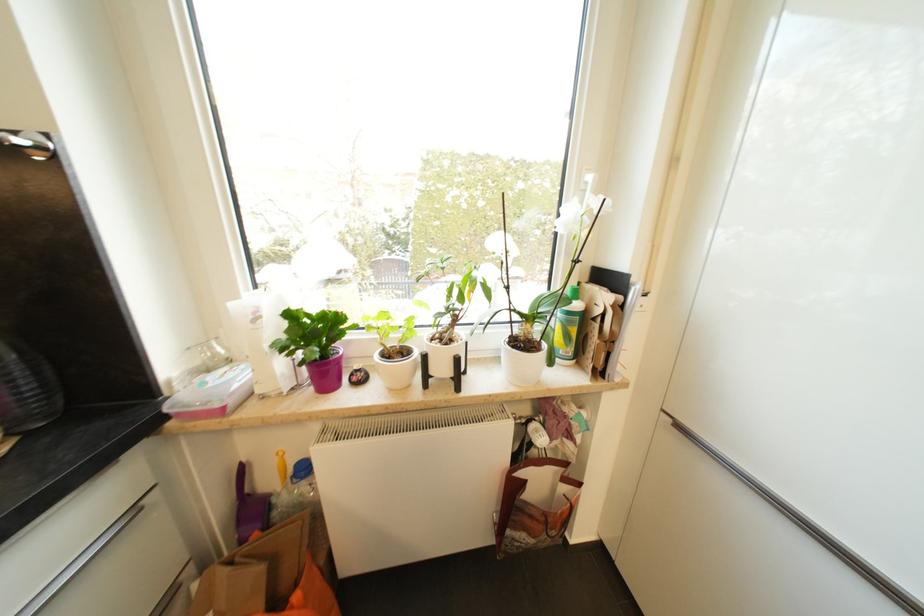
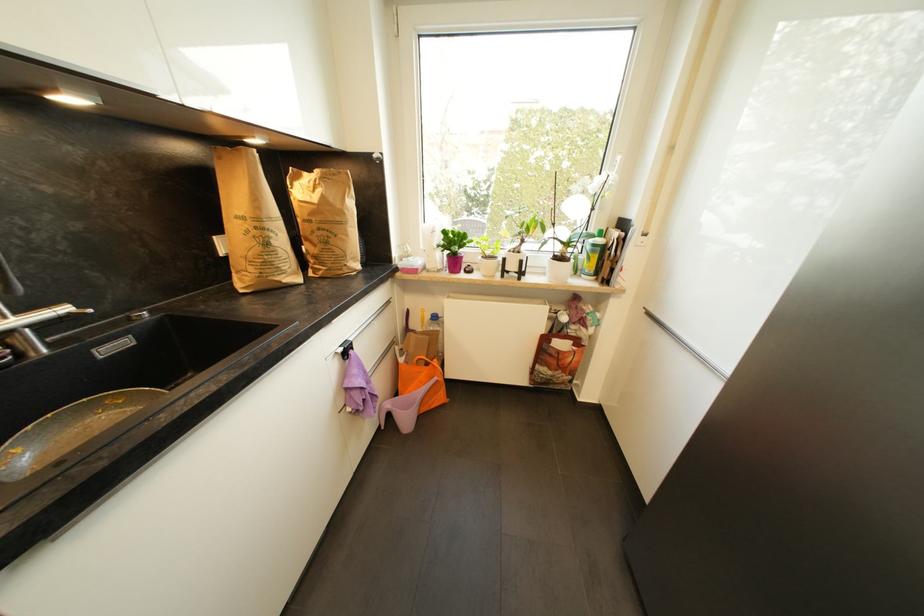
In the second image, find the point that corresponds to pixel 574 315 in the first image.

(599, 246)